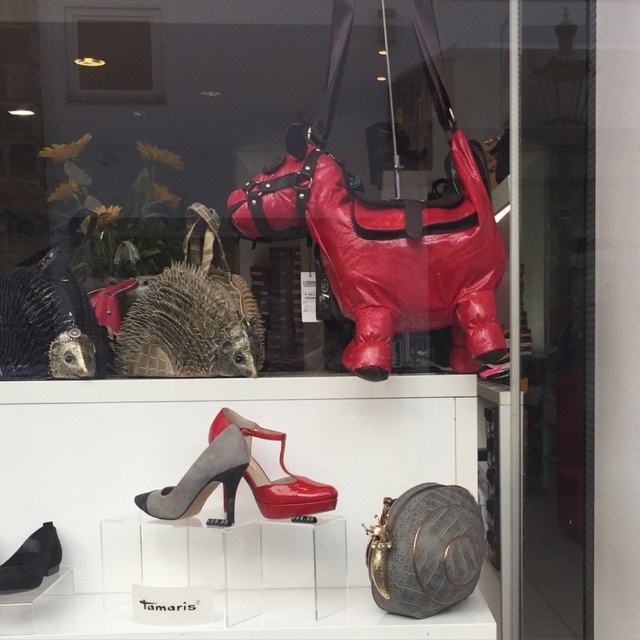
Is shiny red leather horse at upper center in front of suede high-heeled shoe at center?

No, shiny red leather horse at upper center is behind suede high-heeled shoe at center.

Does shiny red leather horse at upper center have a smaller size compared to suede high-heeled shoe at center?

No.

This screenshot has height=640, width=640. What do you see at coordinates (387, 228) in the screenshot? I see `shiny red leather horse at upper center` at bounding box center [387, 228].

Where is `shiny red leather horse at upper center`? shiny red leather horse at upper center is located at coordinates (387, 228).

Which of these two, shiny red leather horse at upper center or shiny patent leather high-heeled shoe at center, stands shorter?

With less height is shiny patent leather high-heeled shoe at center.

Can you confirm if shiny red leather horse at upper center is bigger than shiny patent leather high-heeled shoe at center?

Yes.

Who is more distant from viewer, [243,216] or [300,499]?

The point [243,216] is more distant.

Where is `shiny red leather horse at upper center`? The width and height of the screenshot is (640, 640). shiny red leather horse at upper center is located at coordinates (387, 228).

Does leather textured handbag at lower right have a smaller size compared to metallic gold light fixture at upper center?

Incorrect, leather textured handbag at lower right is not smaller in size than metallic gold light fixture at upper center.

Who is more distant from viewer, (432,586) or (115,97)?

The point (115,97) is behind.

Describe the element at coordinates (424, 548) in the screenshot. I see `leather textured handbag at lower right` at that location.

Identify the location of leather textured handbag at lower right. The image size is (640, 640). (424, 548).